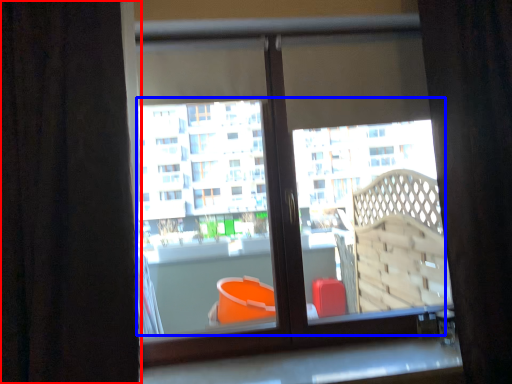
Question: Among these objects, which one is farthest to the camera, curtain (highlighted by a red box) or bay window (highlighted by a blue box)?

Choices:
 (A) curtain
 (B) bay window

Answer: (B)